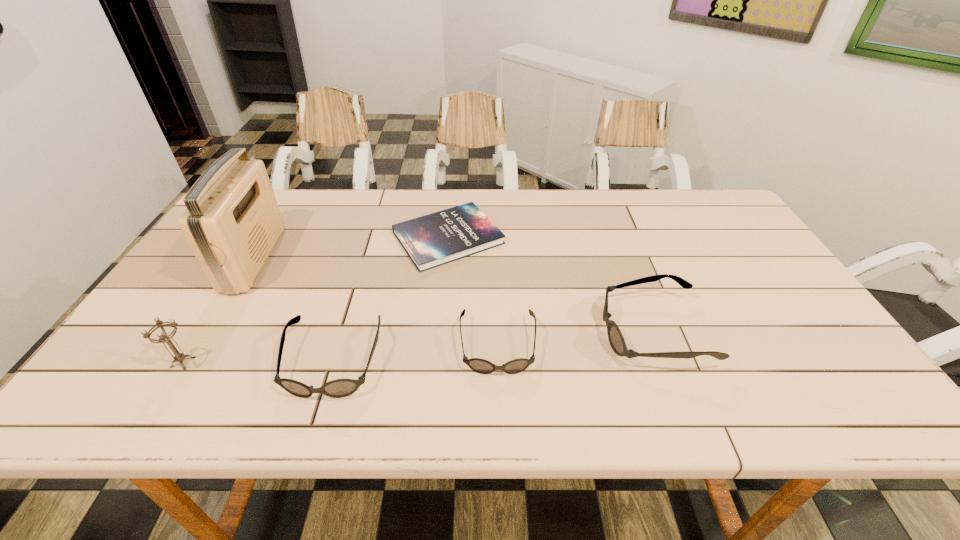
Find the location of a particular element. free spot that satisfies the following two spatial constraints: 1. on the lenses of the rightmost sunglasses; 2. on the lenses of the second sunglasses from right to left is located at coordinates (658, 347).

What are the coordinates of `blank area in the image that satisfies the following two spatial constraints: 1. on the lenses of the rightmost object; 2. on the lenses of the second sunglasses from left to right` in the screenshot? It's located at (658, 347).